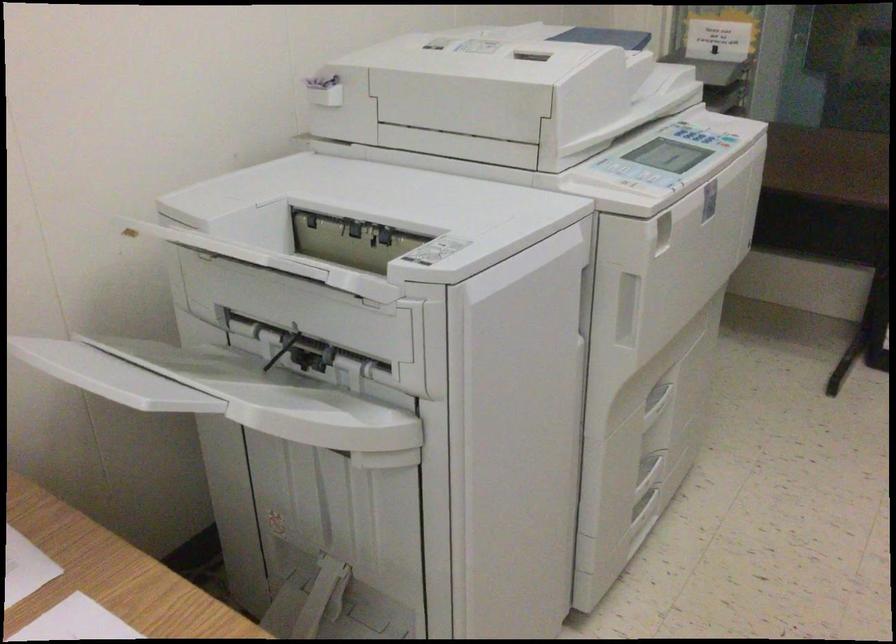
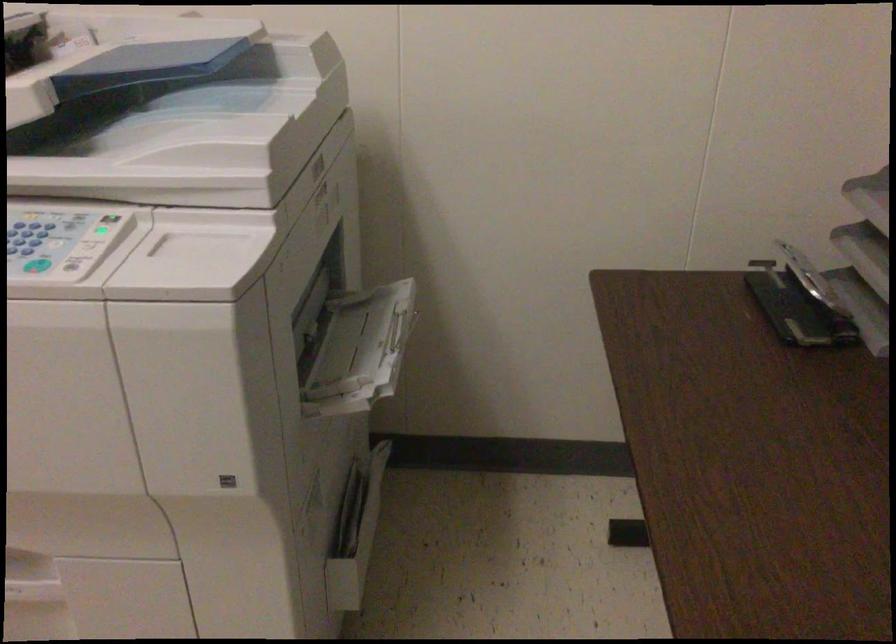
The point at (690,131) is marked in the first image. Where is the corresponding point in the second image?

(92, 241)